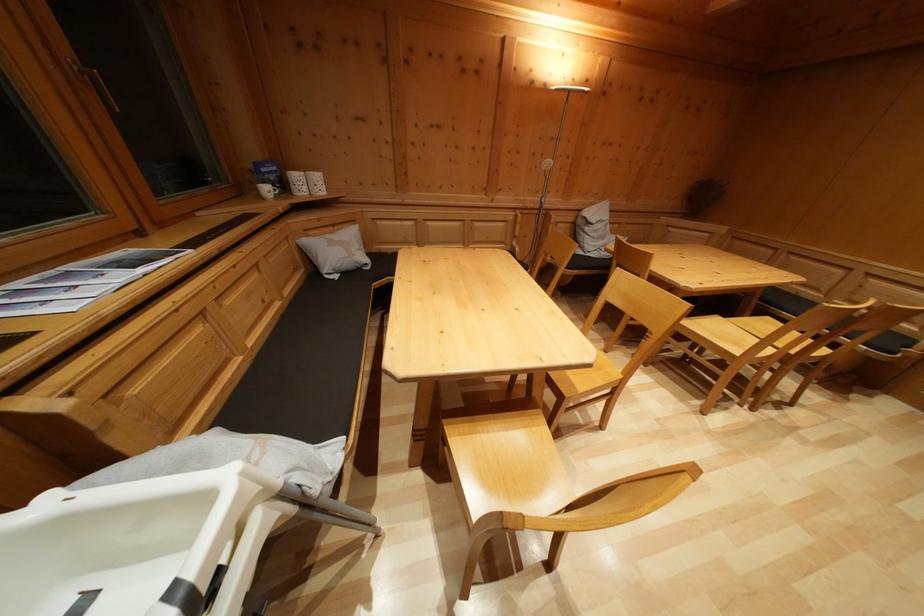
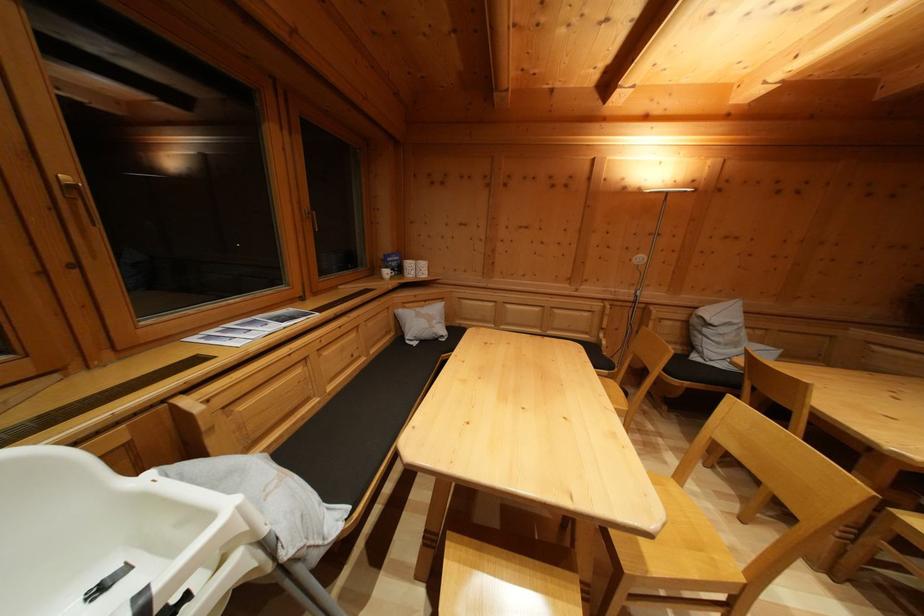
Where in the second image is the point corresponding to point 578,392 from the first image?

(647, 564)